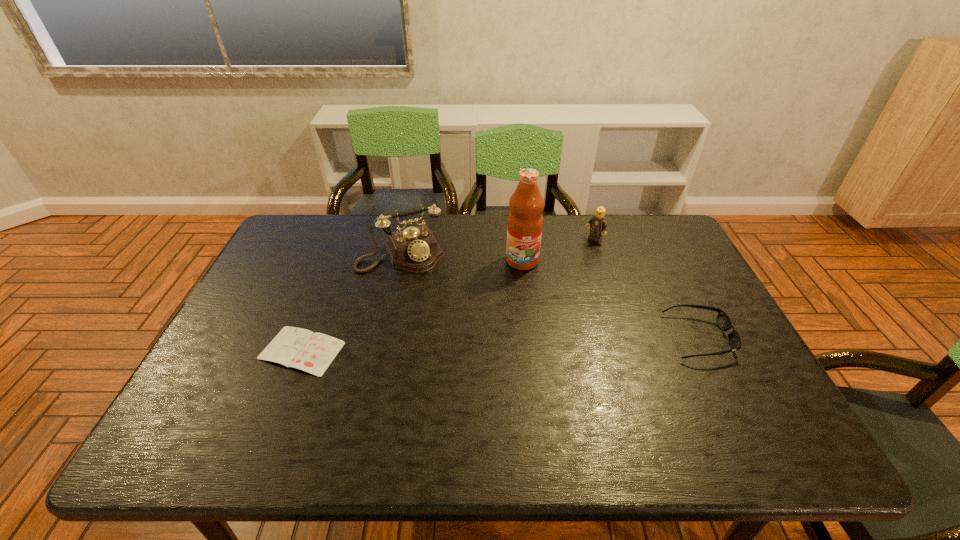
Where is `Lego located in the far edge section of the desktop`? Lego located in the far edge section of the desktop is located at coordinates (598, 222).

Locate an element on the screen. Image resolution: width=960 pixels, height=540 pixels. object located in the left edge section of the desktop is located at coordinates (298, 348).

The width and height of the screenshot is (960, 540). Find the location of `object at the right edge`. object at the right edge is located at coordinates (724, 323).

Locate an element on the screen. This screenshot has height=540, width=960. blank space at the far edge is located at coordinates (438, 220).

Where is `vacant space at the near edge of the desktop`? This screenshot has height=540, width=960. vacant space at the near edge of the desktop is located at coordinates 535,396.

You are a GUI agent. You are given a task and a screenshot of the screen. Output one action in this format:
    pyautogui.click(x=<x>, y=<y>)
    Task: Click on the free space at the right edge of the desktop
    The image size is (960, 540).
    Given the screenshot: What is the action you would take?
    697,269

Where is `blank space at the far left corner of the desktop`? The height and width of the screenshot is (540, 960). blank space at the far left corner of the desktop is located at coordinates (294, 253).

Where is `free space at the near left corner`? free space at the near left corner is located at coordinates point(258,401).

This screenshot has height=540, width=960. Identify the location of free space at the near right corner of the desktop. (767, 414).

The image size is (960, 540). Find the location of `vacant space that's between the shortest object and the Lego`. vacant space that's between the shortest object and the Lego is located at coordinates point(448,295).